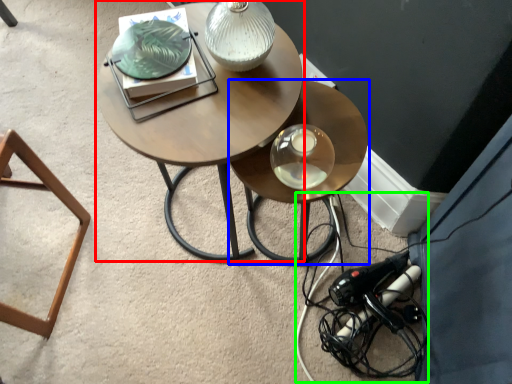
Question: Estimate the real-world distances between objects in this image. Which object is farther from coffee table (highlighted by a red box), table (highlighted by a blue box) or cable (highlighted by a green box)?

Choices:
 (A) table
 (B) cable

Answer: (B)